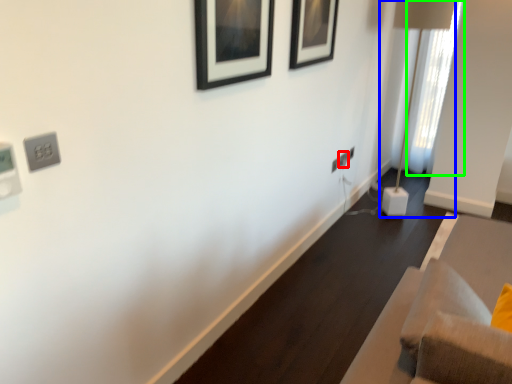
Question: Estimate the real-world distances between objects in this image. Which object is closer to electric outlet (highlighted by a red box), table lamp (highlighted by a blue box) or curtain (highlighted by a green box)?

Choices:
 (A) table lamp
 (B) curtain

Answer: (A)